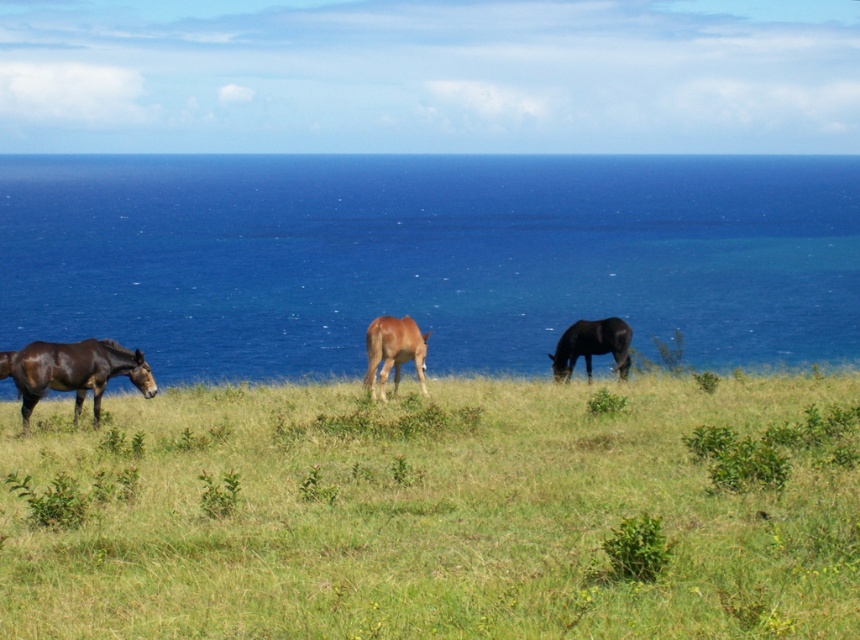
Question: Which of the following is the farthest from the observer?

Choices:
 (A) green grassy at center
 (B) brown matte horse at center
 (C) blue water at center

Answer: (C)

Question: Estimate the real-world distances between objects in this image. Which object is closer to the green grassy at center?

Choices:
 (A) shiny brown horse at left
 (B) black glossy horse at center
 (C) blue water at center
 (D) brown matte horse at center

Answer: (D)

Question: Is blue water at center smaller than brown matte horse at center?

Choices:
 (A) yes
 (B) no

Answer: (B)

Question: Is green grassy at center above brown matte horse at center?

Choices:
 (A) yes
 (B) no

Answer: (B)

Question: Can you confirm if blue water at center is positioned below brown matte horse at center?

Choices:
 (A) no
 (B) yes

Answer: (A)

Question: Based on their relative distances, which object is farther from the brown matte horse at center?

Choices:
 (A) black glossy horse at center
 (B) green grassy at center
 (C) blue water at center
 (D) shiny brown horse at left

Answer: (C)